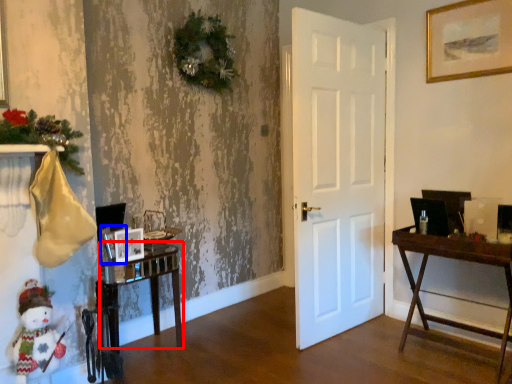
Question: Which point is closer to the camera, table (highlighted by a red box) or picture frame (highlighted by a blue box)?

Choices:
 (A) table
 (B) picture frame

Answer: (A)